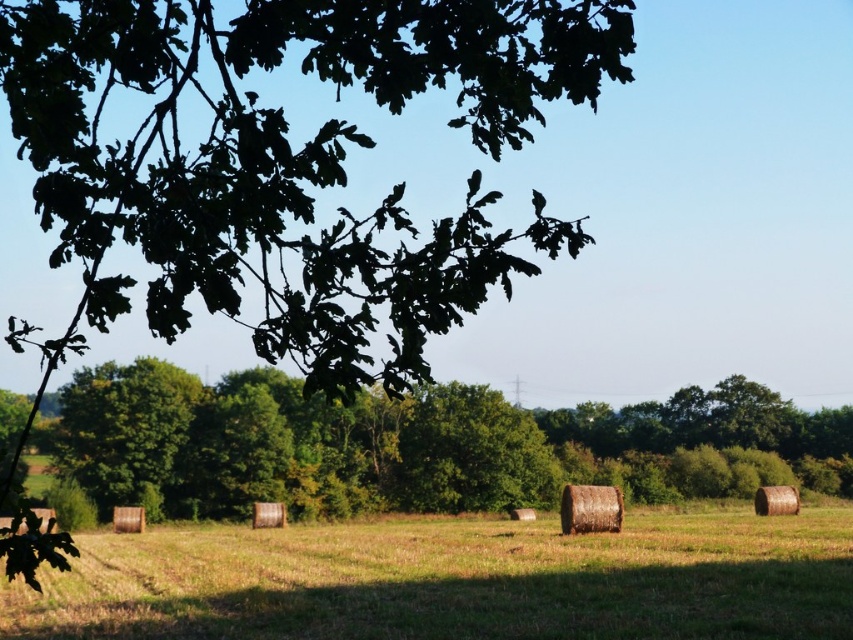
Who is shorter, green grass at center or green leafy tree at center?

green grass at center is shorter.

Does point (113, 570) lie behind point (384, 422)?

That is False.

At what (x,y) coordinates should I click in order to perform the action: click on green grass at center. Please return your answer as a coordinate pair (x, y). The width and height of the screenshot is (853, 640). Looking at the image, I should click on (456, 580).